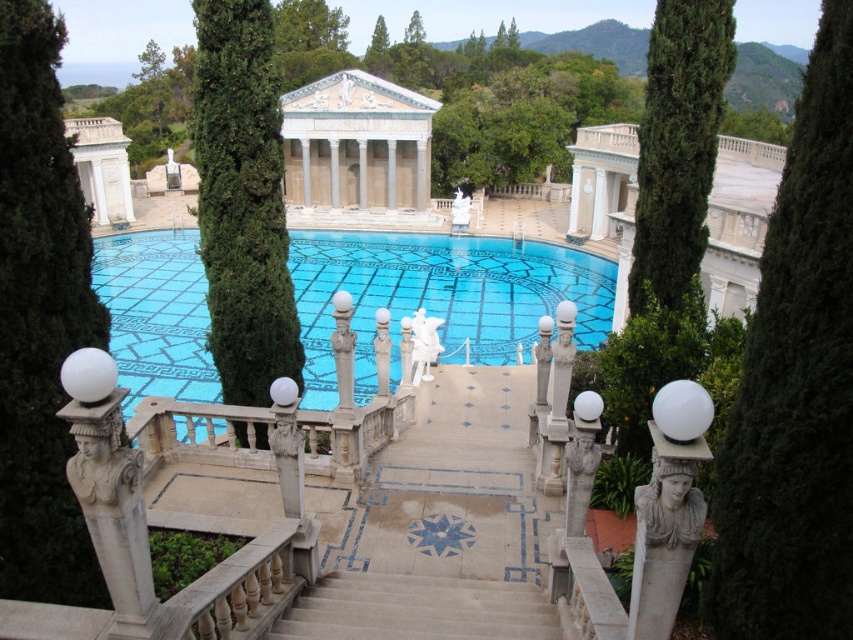
Where is `white marble temple at center`? The image size is (853, 640). white marble temple at center is located at coordinates (357, 141).

Which is behind, point (381, 141) or point (476, 614)?

The point (381, 141) is behind.

The image size is (853, 640). I want to click on white marble temple at center, so click(x=357, y=141).

You are a GUI agent. You are given a task and a screenshot of the screen. Output one action in this format:
    pyautogui.click(x=<x>, y=<y>)
    Task: Click on the white marble temple at center
    The width and height of the screenshot is (853, 640).
    Given the screenshot: What is the action you would take?
    pyautogui.click(x=357, y=141)

Is green leafy tree at left taller than green coniferous tree at upper center?

No.

Does green leafy tree at left have a greater width compared to green coniferous tree at upper center?

No.

Does point (9, 582) come behind point (711, 17)?

That is False.

Find the location of a particular element. The width and height of the screenshot is (853, 640). green leafy tree at left is located at coordinates (39, 317).

Which of these two, blue mosaic tiles at center or green textured tree at center, stands taller?

blue mosaic tiles at center is taller.

Describe the element at coordinates (438, 296) in the screenshot. The height and width of the screenshot is (640, 853). I see `blue mosaic tiles at center` at that location.

This screenshot has width=853, height=640. What do you see at coordinates (438, 296) in the screenshot?
I see `blue mosaic tiles at center` at bounding box center [438, 296].

Locate an element on the screen. The height and width of the screenshot is (640, 853). blue mosaic tiles at center is located at coordinates (438, 296).